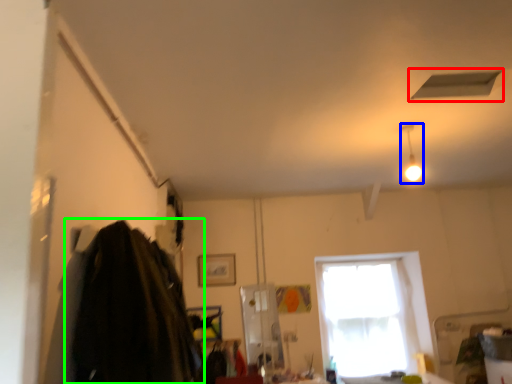
Question: Which object is positioned closest to exhaust hood (highlighted by a red box)? Select from light fixture (highlighted by a blue box) and clothing (highlighted by a green box).

Choices:
 (A) light fixture
 (B) clothing

Answer: (A)